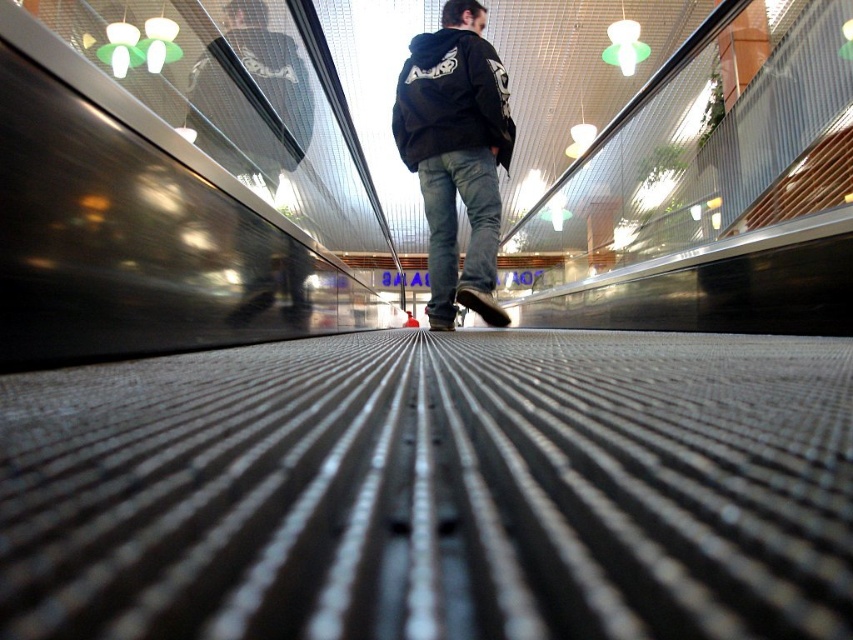
You are standing on a moving walkway and see a person wearing a black cotton hoodie at center and denim at center. If you want to hand them a small item, can you reach them while staying in place?

The black cotton hoodie at center and denim at center are 17.71 inches apart, so if you stay in place on the moving walkway, you can likely reach them with your arm extended since the distance is within typical arm reach.

You are standing on the moving walkway shown in the image. You notice two points marked on the surface. The first point is at coordinates point [448,84], and the second point is at coordinates point [467,182]. Which point is closer to your eyes?

Point [448,84] is closer to the camera than point [467,182].

You are standing on a moving walkway and see two hoodies in front of you. The first is a black matte hoodie at center and the second is a black cotton hoodie at center. Which one is closer to you?

The black matte hoodie at center is closer to you than the black cotton hoodie at center since the distance between them is 5.10 inches.